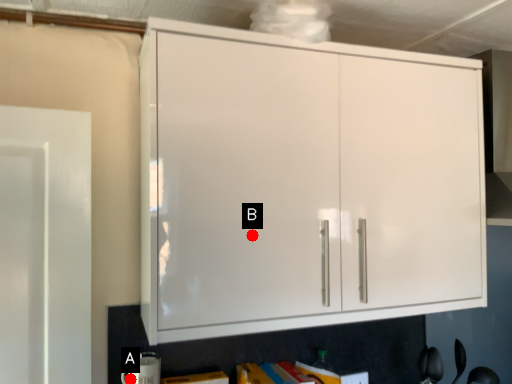
Question: Two points are circled on the image, labeled by A and B beside each circle. Which point is farther to the camera?

Choices:
 (A) A is further
 (B) B is further

Answer: (A)